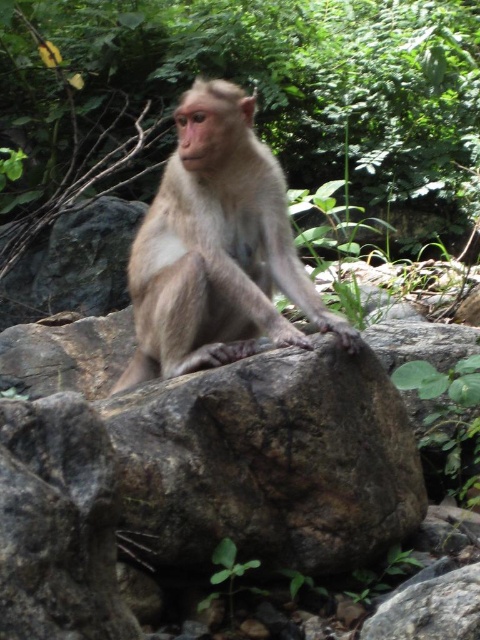
Is green leafy tree at center shorter than furry beige monkey at center?

No, green leafy tree at center is not shorter than furry beige monkey at center.

From the picture: Measure the distance between green leafy tree at center and camera.

green leafy tree at center and camera are 4.08 meters apart from each other.

Looking at this image, who is more distant from viewer, (x=274, y=147) or (x=183, y=150)?

Point (x=274, y=147)

I want to click on green leafy tree at center, so click(x=250, y=86).